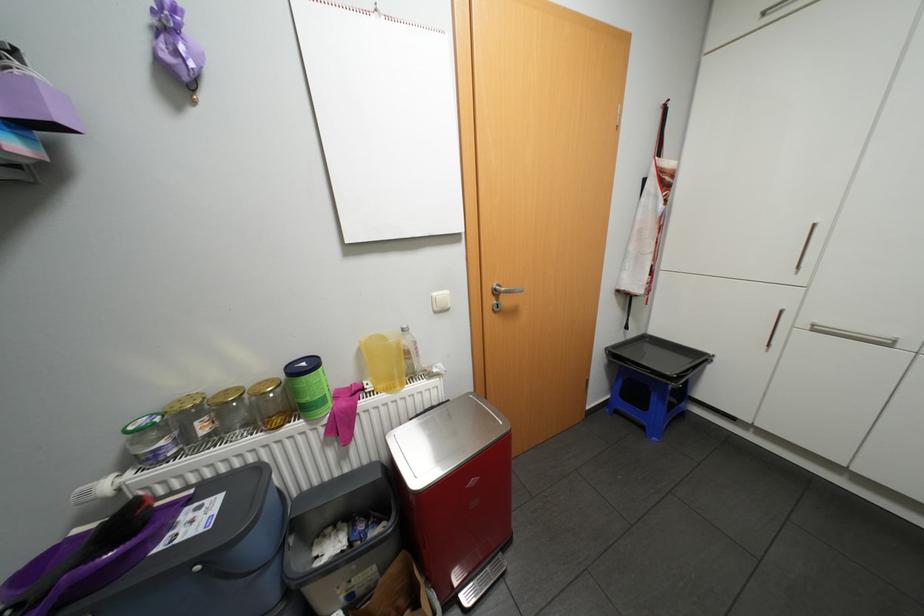
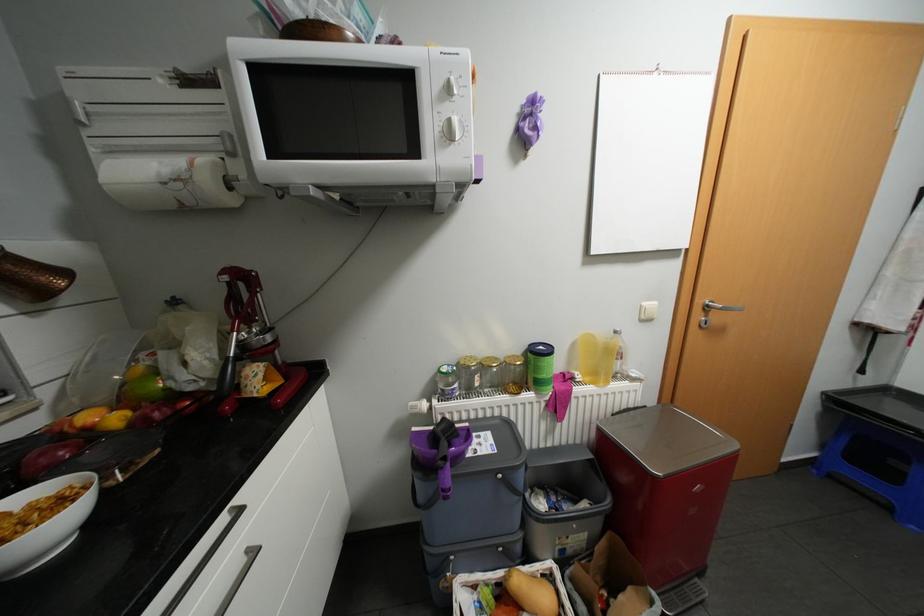
In the second image, find the point that corresponds to [314,419] in the first image.

(544, 392)